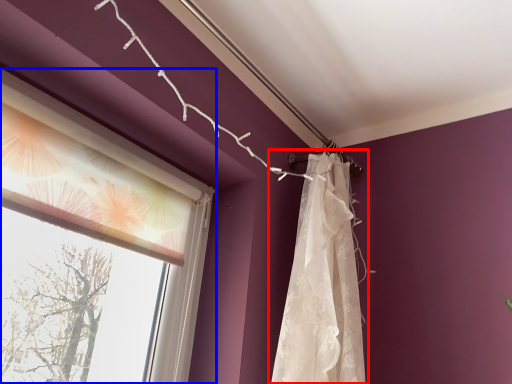
Question: Which point is closer to the camera, curtain (highlighted by a red box) or window (highlighted by a blue box)?

Choices:
 (A) curtain
 (B) window

Answer: (B)